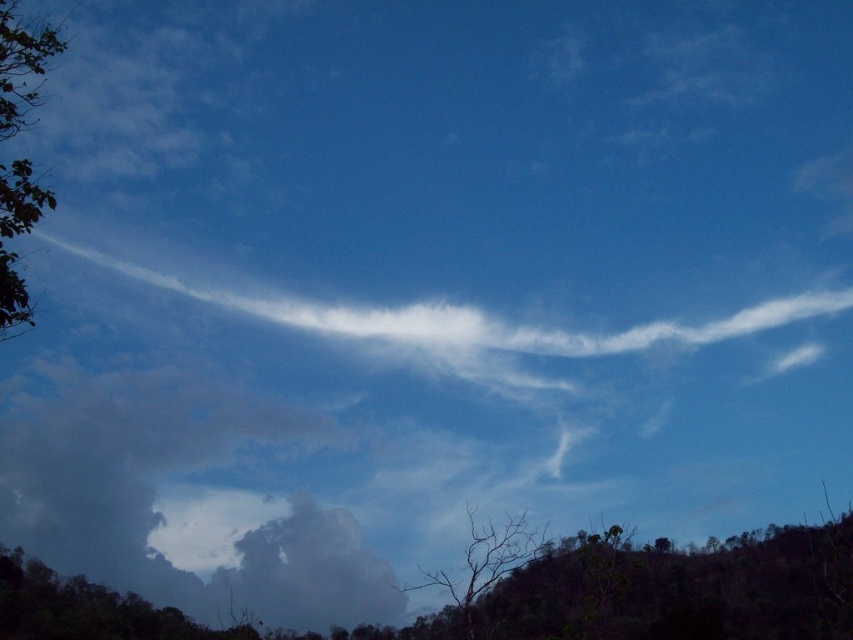
Between green leafy tree at lower left and green leafy tree at left, which one is positioned higher?

green leafy tree at left

Looking at this image, can you confirm if green leafy tree at lower left is positioned to the right of green leafy tree at left?

No, green leafy tree at lower left is not to the right of green leafy tree at left.

This screenshot has height=640, width=853. Identify the location of green leafy tree at lower left. (86, 609).

Where is `green leafy tree at lower left`? This screenshot has height=640, width=853. green leafy tree at lower left is located at coordinates pos(86,609).

This screenshot has width=853, height=640. Identify the location of green leafy tree at lower left. (86, 609).

You are a GUI agent. You are given a task and a screenshot of the screen. Output one action in this format:
    pyautogui.click(x=<x>, y=<y>)
    Task: Click on the green leafy tree at lower left
    This screenshot has height=640, width=853.
    Given the screenshot: What is the action you would take?
    pyautogui.click(x=86, y=609)

Between green leafy tree at left and bare wood tree at lower center, which one has less height?

Result: Standing shorter between the two is bare wood tree at lower center.

At what (x,y) coordinates should I click in order to perform the action: click on green leafy tree at left. Please return your answer as a coordinate pair (x, y). Looking at the image, I should click on (21, 67).